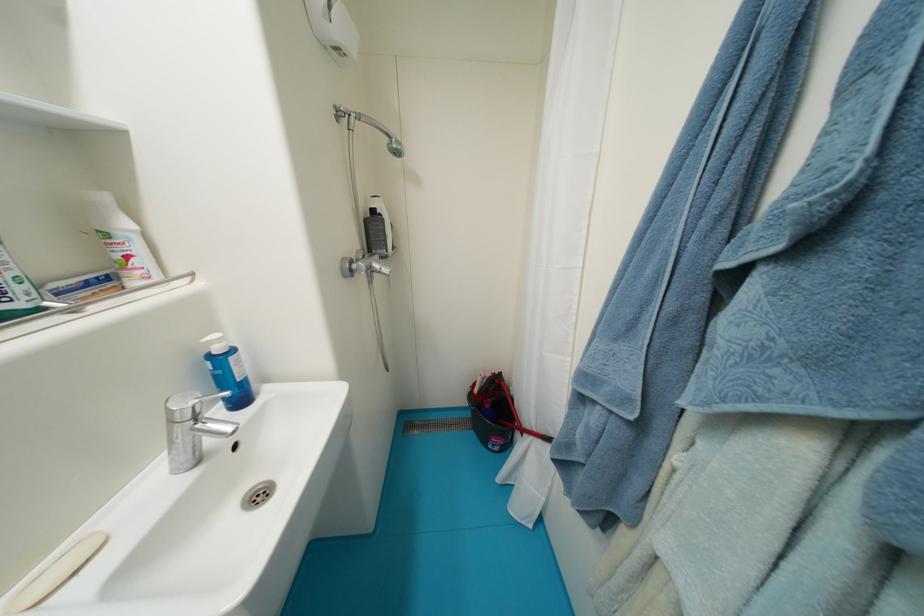
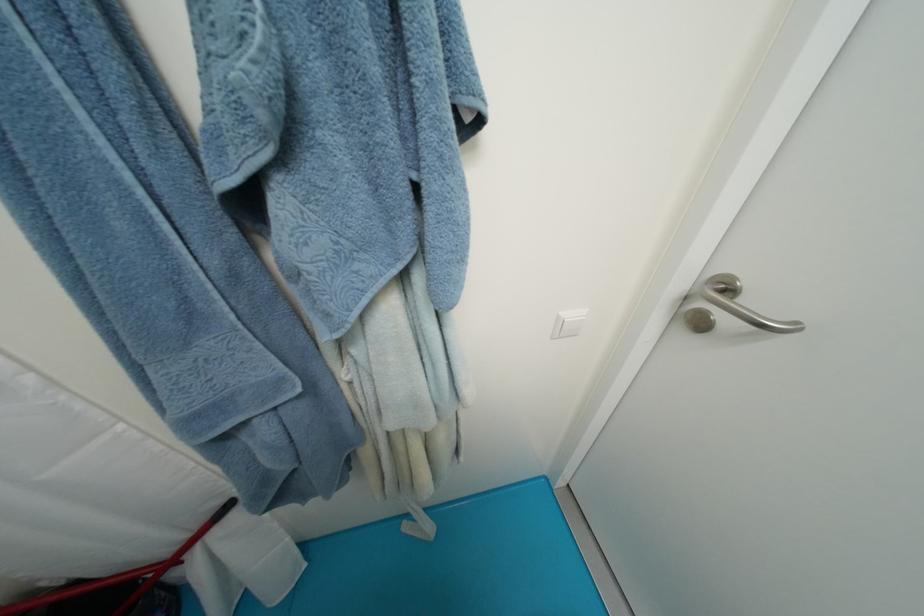
The images are taken continuously from a first-person perspective. In which direction is your viewpoint rotating?

The camera's rotation is toward right-down.